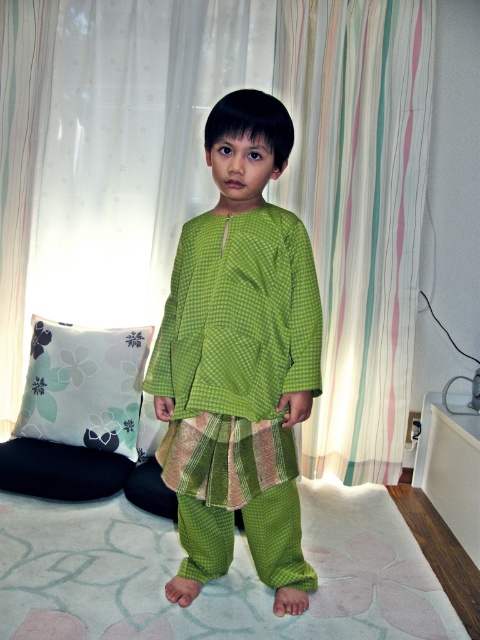
Question: Which object is the closest to the white fabric pillow at lower left?

Choices:
 (A) striped fabric curtain at right
 (B) green checkered outfit at center

Answer: (B)

Question: Which of the following is the farthest from the observer?

Choices:
 (A) (266, 369)
 (B) (124, 452)
 (C) (418, 26)

Answer: (C)

Question: Is striped fabric curtain at right positioned at the back of white fabric pillow at lower left?

Choices:
 (A) yes
 (B) no

Answer: (A)

Question: Can you confirm if striped fabric curtain at upper center is bigger than white fabric pillow at lower left?

Choices:
 (A) yes
 (B) no

Answer: (A)

Question: Can you confirm if green checkered outfit at center is positioned to the right of white fabric pillow at lower left?

Choices:
 (A) no
 (B) yes

Answer: (B)

Question: Among these objects, which one is nearest to the camera?

Choices:
 (A) green checkered outfit at center
 (B) striped fabric curtain at right

Answer: (A)